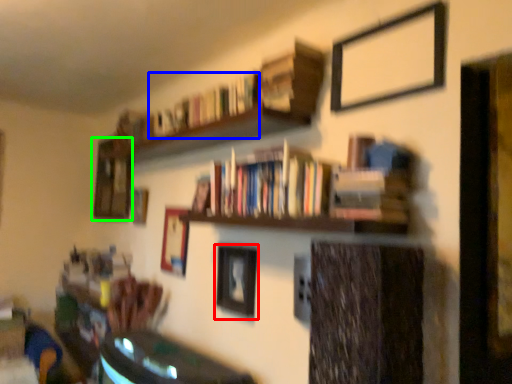
Question: Estimate the real-world distances between objects in this image. Which object is closer to picture frame (highlighted by a red box), book (highlighted by a blue box) or picture frame (highlighted by a green box)?

Choices:
 (A) book
 (B) picture frame

Answer: (A)